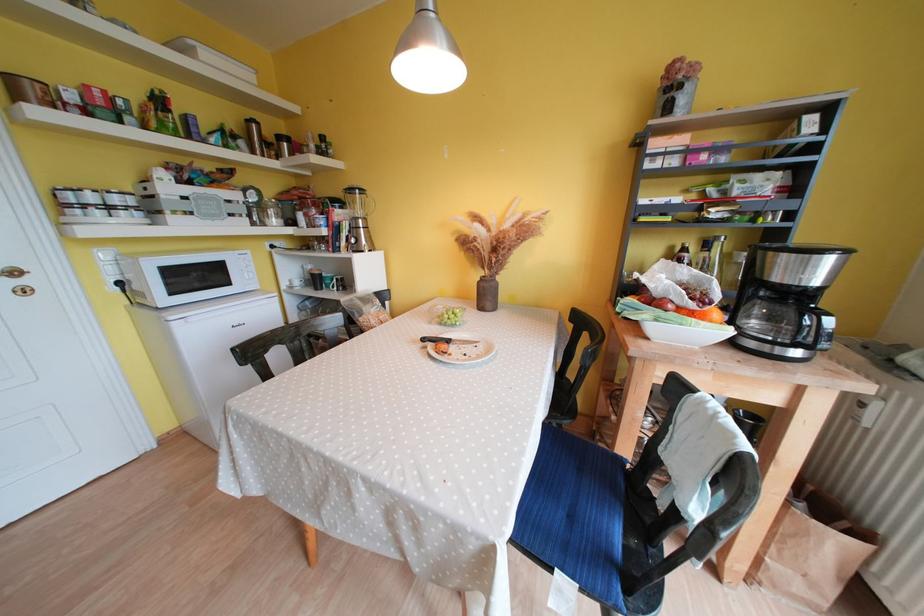
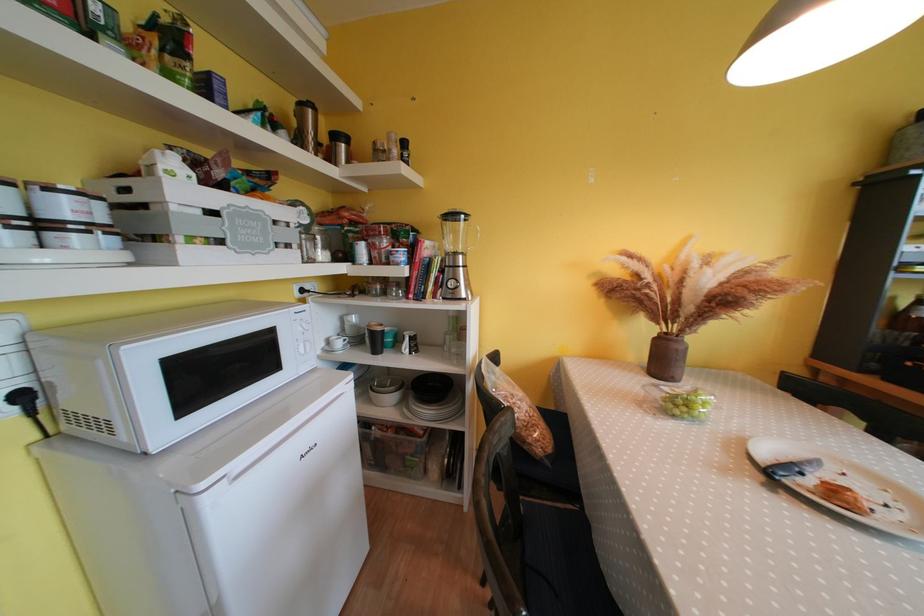
In the second image, find the point that corresponds to the point at 354,240 in the first image.

(444, 282)